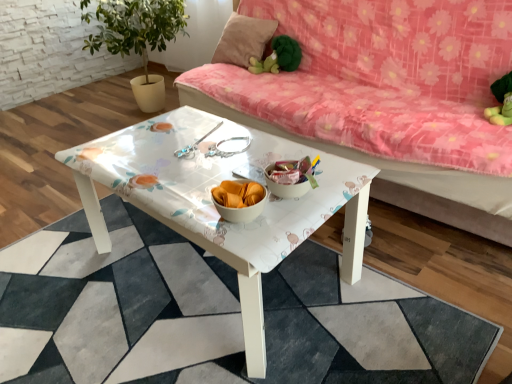
Question: Is pink fabric pillow at upper center not inside green plush toy at upper center?

Choices:
 (A) no
 (B) yes

Answer: (B)

Question: Is pink fabric pillow at upper center thinner than green plush toy at upper center?

Choices:
 (A) yes
 (B) no

Answer: (B)

Question: Could green plush toy at upper center be considered to be inside pink fabric pillow at upper center?

Choices:
 (A) yes
 (B) no

Answer: (B)

Question: From a real-world perspective, is pink fabric pillow at upper center positioned over green plush toy at upper center based on gravity?

Choices:
 (A) yes
 (B) no

Answer: (A)

Question: Can you confirm if pink fabric pillow at upper center is smaller than green plush toy at upper center?

Choices:
 (A) no
 (B) yes

Answer: (A)

Question: Is white glossy table at center in front of or behind green plush toy at upper center in the image?

Choices:
 (A) front
 (B) behind

Answer: (A)

Question: Is white glossy table at center wider or thinner than green plush toy at upper center?

Choices:
 (A) wide
 (B) thin

Answer: (A)

Question: From the image's perspective, is white glossy table at center located above or below green plush toy at upper center?

Choices:
 (A) below
 (B) above

Answer: (A)

Question: Based on their positions, is white glossy table at center located to the left or right of green plush toy at upper center?

Choices:
 (A) left
 (B) right

Answer: (A)

Question: In terms of size, does floral fabric couch at upper center appear bigger or smaller than white glossy coffee table at center?

Choices:
 (A) small
 (B) big

Answer: (B)

Question: From the image's perspective, is floral fabric couch at upper center above or below white glossy coffee table at center?

Choices:
 (A) above
 (B) below

Answer: (A)

Question: From a real-world perspective, is floral fabric couch at upper center above or below white glossy coffee table at center?

Choices:
 (A) above
 (B) below

Answer: (A)

Question: Considering the positions of floral fabric couch at upper center and white glossy coffee table at center in the image, is floral fabric couch at upper center wider or thinner than white glossy coffee table at center?

Choices:
 (A) thin
 (B) wide

Answer: (A)

Question: From a real-world perspective, is white glossy coffee table at center positioned above or below pink fabric pillow at upper center?

Choices:
 (A) below
 (B) above

Answer: (A)

Question: From the image's perspective, is white glossy coffee table at center above or below pink fabric pillow at upper center?

Choices:
 (A) above
 (B) below

Answer: (B)